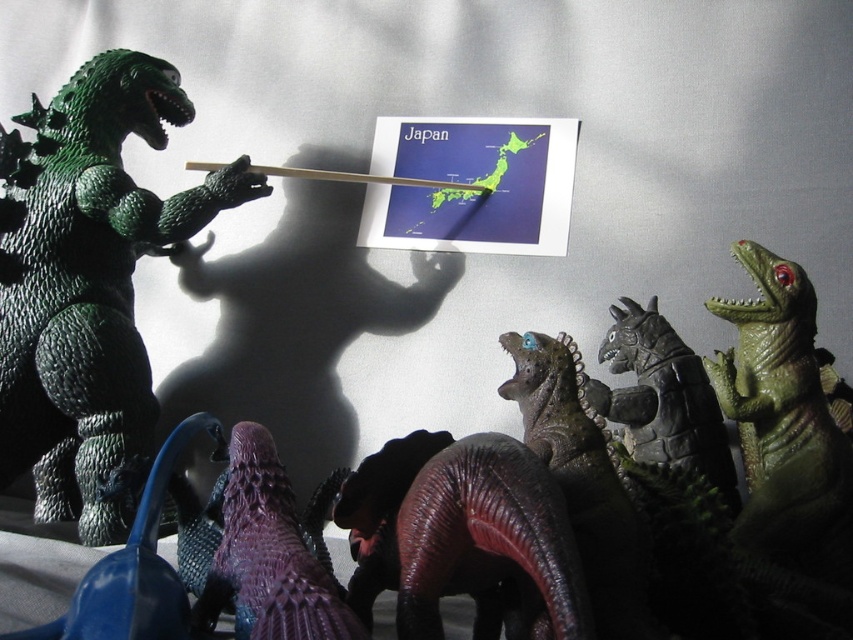
Question: Is green rubbery dinosaur at left to the left of purple matte dinosaur at lower center from the viewer's perspective?

Choices:
 (A) yes
 (B) no

Answer: (A)

Question: Is green rubbery dinosaur at left positioned at the back of purple matte dinosaur at lower center?

Choices:
 (A) yes
 (B) no

Answer: (A)

Question: Can you confirm if green rubbery dinosaur at left is positioned above purple matte dinosaur at lower center?

Choices:
 (A) yes
 (B) no

Answer: (A)

Question: Which of the following is the closest to the observer?

Choices:
 (A) (238, 586)
 (B) (53, 516)

Answer: (A)

Question: Which point is closer to the camera taking this photo?

Choices:
 (A) (x=48, y=310)
 (B) (x=280, y=624)

Answer: (B)

Question: Which of the following is the closest to the observer?

Choices:
 (A) (254, 432)
 (B) (61, 108)

Answer: (A)